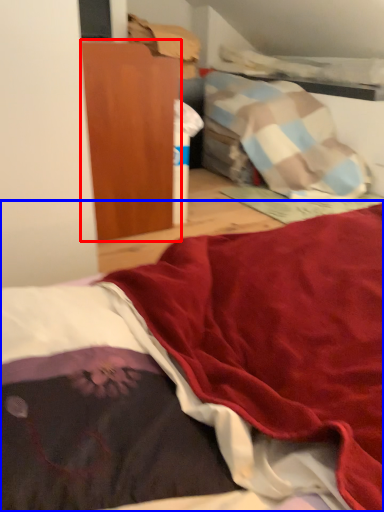
Question: Among these objects, which one is nearest to the camera, furniture (highlighted by a red box) or bed (highlighted by a blue box)?

Choices:
 (A) furniture
 (B) bed

Answer: (B)